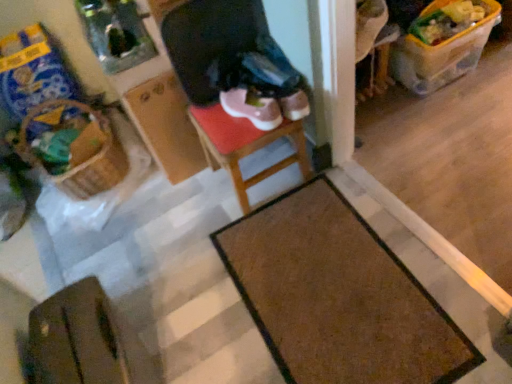
What do you see at coordinates (245, 146) in the screenshot? This screenshot has width=512, height=384. I see `wooden stool at center` at bounding box center [245, 146].

Image resolution: width=512 pixels, height=384 pixels. I want to click on wooden stool at center, so click(245, 146).

Between pink suede sneakers at center and brown woven basket at left, which one appears on the left side from the viewer's perspective?

From the viewer's perspective, brown woven basket at left appears more on the left side.

Is point (245, 95) behind point (100, 161)?

No, it is in front of (100, 161).

Does pink suede sneakers at center turn towards brown woven basket at left?

No, pink suede sneakers at center is not oriented towards brown woven basket at left.

Does pink suede sneakers at center have a smaller size compared to brown woven basket at left?

Yes.

Based on the photo, is brown leather wallet at lower left inside the boundaries of brown textured mat at lower center, or outside?

brown leather wallet at lower left is located beyond the bounds of brown textured mat at lower center.

Is brown leather wallet at lower left far away from brown textured mat at lower center?

No, brown leather wallet at lower left is not far from brown textured mat at lower center.

Is brown textured mat at lower center at the back of brown leather wallet at lower left?

No.

Considering the sizes of objects brown woven basket at left and pink suede sneakers at center in the image provided, who is taller, brown woven basket at left or pink suede sneakers at center?

brown woven basket at left.

Considering the positions of points (38, 110) and (255, 121), is point (38, 110) closer to camera compared to point (255, 121)?

No, (38, 110) is behind (255, 121).

Can you confirm if brown woven basket at left is wider than pink suede sneakers at center?

Yes.

Are brown woven basket at left and pink suede sneakers at center far apart?

That's not correct — brown woven basket at left is a little close to pink suede sneakers at center.

Is brown textured mat at lower center bigger or smaller than brown woven basket at left?

In the image, brown textured mat at lower center appears to be smaller than brown woven basket at left.

Consider the image. Is brown textured mat at lower center positioned with its back to brown woven basket at left?

That's not correct — brown textured mat at lower center is not looking away from brown woven basket at left.

Can you confirm if brown textured mat at lower center is shorter than brown woven basket at left?

Yes.

Which point is more distant from viewer, (70, 363) or (284, 164)?

Point (284, 164)

Is wooden stool at center at the back of brown leather wallet at lower left?

No, brown leather wallet at lower left's orientation is not away from wooden stool at center.

Considering the relative sizes of brown leather wallet at lower left and wooden stool at center in the image provided, is brown leather wallet at lower left thinner than wooden stool at center?

Yes.

From a real-world perspective, is brown leather wallet at lower left positioned over wooden stool at center based on gravity?

Yes, from a real-world perspective, brown leather wallet at lower left is over wooden stool at center

Is wooden stool at center not close to brown textured mat at lower center?

wooden stool at center is actually quite close to brown textured mat at lower center.

From the image's perspective, is wooden stool at center above or below brown textured mat at lower center?

Based on their image positions, wooden stool at center is located above brown textured mat at lower center.

You are a GUI agent. You are given a task and a screenshot of the screen. Output one action in this format:
    pyautogui.click(x=<x>, y=<y>)
    Task: Click on the furniture above the brown textured mat at lower center (from the image's perspective)
    Image resolution: width=512 pixels, height=384 pixels.
    Given the screenshot: What is the action you would take?
    (245, 146)

Can you see brown leather wallet at lower left touching pink suede sneakers at center?

brown leather wallet at lower left and pink suede sneakers at center are clearly separated.

At what (x,y) coordinates should I click in order to perform the action: click on footwear behind the brown leather wallet at lower left. Please return your answer as a coordinate pair (x, y). The image size is (512, 384). Looking at the image, I should click on (252, 109).

Which is more to the left, brown leather wallet at lower left or pink suede sneakers at center?

brown leather wallet at lower left is more to the left.

From a real-world perspective, is brown leather wallet at lower left positioned under pink suede sneakers at center based on gravity?

Yes, from a real-world perspective, brown leather wallet at lower left is below pink suede sneakers at center.

Identify the location of footwear that is above the brown woven basket at left (from the image's perspective). (252, 109).

Find the location of a particular element. wide below the brown textured mat at lower center (from the image's perspective) is located at coordinates (76, 338).

Estimate the real-world distances between objects in this image. Which object is closer to wooden stool at center, pink suede sneakers at center or brown woven basket at left?

pink suede sneakers at center.

When comparing their distances from pink suede sneakers at center, does brown leather wallet at lower left or brown textured mat at lower center seem further?

Among the two, brown leather wallet at lower left is located further to pink suede sneakers at center.

Based on their spatial positions, is brown textured mat at lower center or pink suede sneakers at center closer to wooden stool at center?

Among the two, pink suede sneakers at center is located nearer to wooden stool at center.

When comparing their distances from brown woven basket at left, does brown textured mat at lower center or brown leather wallet at lower left seem further?

Based on the image, brown textured mat at lower center appears to be further to brown woven basket at left.

Which object lies nearer to the anchor point pink suede sneakers at center, brown leather wallet at lower left or brown woven basket at left?

brown woven basket at left lies closer to pink suede sneakers at center than the other object.

When comparing their distances from pink suede sneakers at center, does wooden stool at center or brown leather wallet at lower left seem further?

brown leather wallet at lower left is positioned further to the anchor pink suede sneakers at center.

When comparing their distances from brown leather wallet at lower left, does brown textured mat at lower center or pink suede sneakers at center seem closer?

The object closer to brown leather wallet at lower left is brown textured mat at lower center.

From the image, which object appears to be farther from brown leather wallet at lower left, wooden stool at center or brown woven basket at left?

The object further to brown leather wallet at lower left is brown woven basket at left.

The image size is (512, 384). Identify the location of footwear located between brown woven basket at left and wooden stool at center in the left-right direction. click(x=252, y=109).

Identify the location of wide located between brown woven basket at left and wooden stool at center in the left-right direction. The image size is (512, 384). (76, 338).

This screenshot has height=384, width=512. Find the location of `footwear between brown woven basket at left and brown textured mat at lower center from left to right`. footwear between brown woven basket at left and brown textured mat at lower center from left to right is located at coordinates (252, 109).

Where is `furniture between pink suede sneakers at center and brown leather wallet at lower left in the vertical direction`? This screenshot has height=384, width=512. furniture between pink suede sneakers at center and brown leather wallet at lower left in the vertical direction is located at coordinates (245, 146).